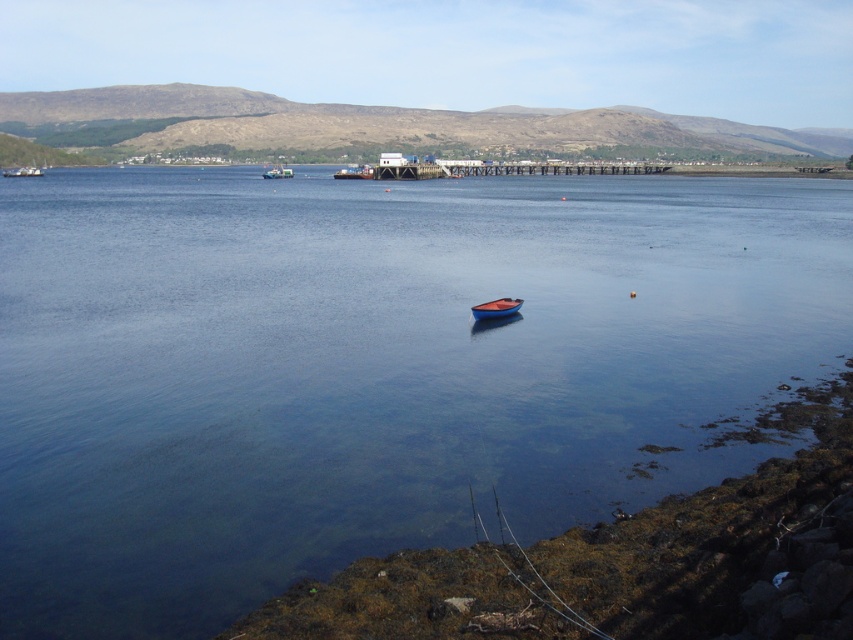
Question: Is metallic silver boat at upper left thinner than metallic blue boat at center?

Choices:
 (A) yes
 (B) no

Answer: (B)

Question: Which point is closer to the camera?

Choices:
 (A) (171, 257)
 (B) (22, 170)
 (C) (273, 168)

Answer: (A)

Question: Which object appears farthest from the camera in this image?

Choices:
 (A) blue glossy boat at center
 (B) metallic silver boat at upper left
 (C) clear blue water at center
 (D) metallic blue boat at center

Answer: (B)

Question: Among these objects, which one is nearest to the camera?

Choices:
 (A) blue glossy boat at center
 (B) metallic silver boat at upper left
 (C) clear blue water at center

Answer: (C)

Question: Does clear blue water at center appear under metallic silver boat at upper left?

Choices:
 (A) yes
 (B) no

Answer: (A)

Question: Can you confirm if clear blue water at center is positioned to the left of blue glossy boat at center?

Choices:
 (A) no
 (B) yes

Answer: (B)